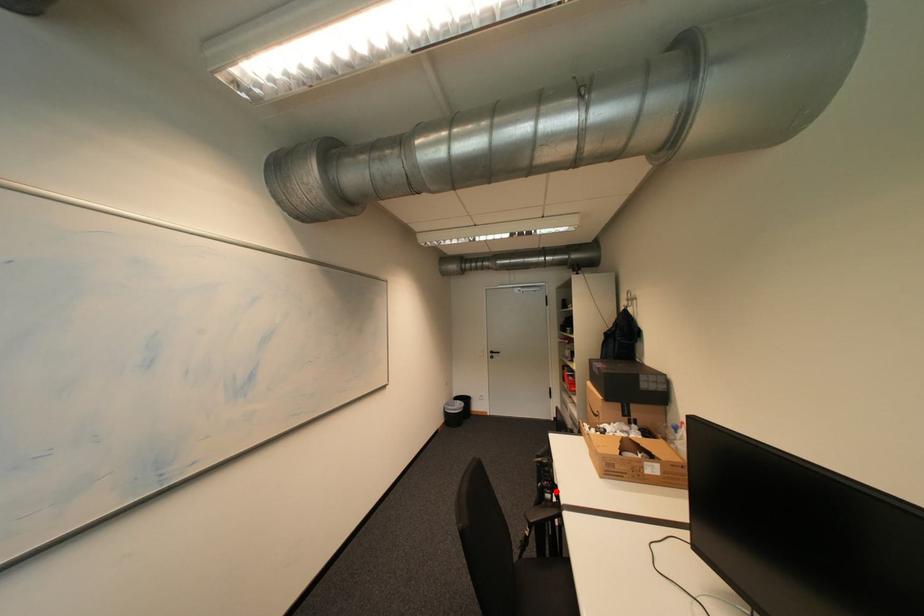
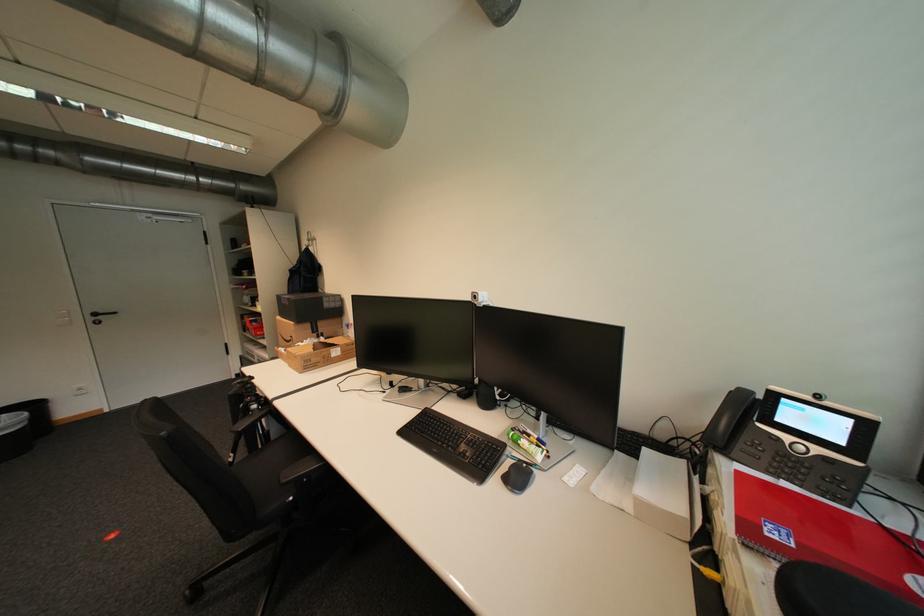
Question: I am providing you with two images of the same scene from different viewpoints. Image1 has a red point marked. In image2, the corresponding 3D location appears at what relative position? Reply with the corresponding letter.

Choices:
 (A) Closer
 (B) Farther

Answer: (A)